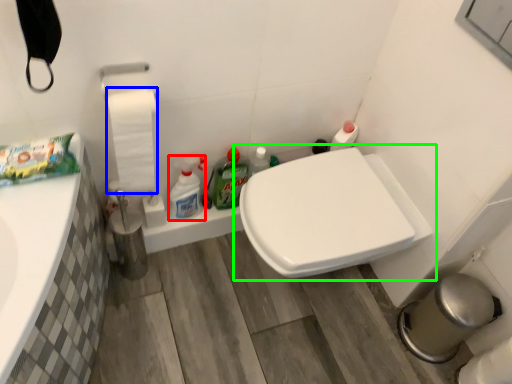
Question: Estimate the real-world distances between objects in this image. Which object is farther from cleaning product (highlighted by a red box), toilet paper (highlighted by a blue box) or toilet (highlighted by a green box)?

Choices:
 (A) toilet paper
 (B) toilet

Answer: (B)